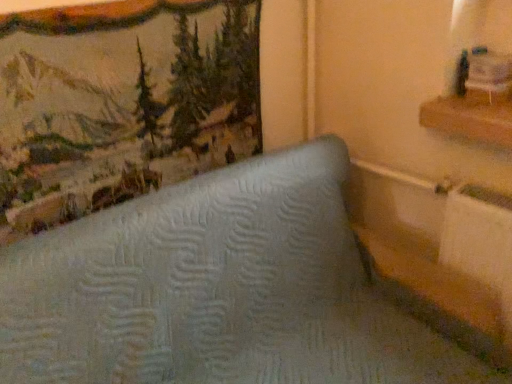
Question: Should I look upward or downward to see light blue quilted mattress at center?

Choices:
 (A) down
 (B) up

Answer: (A)

Question: Are wooden shelf at upper right and textured fabric picture frame at upper left beside each other?

Choices:
 (A) yes
 (B) no

Answer: (B)

Question: From a real-world perspective, is wooden shelf at upper right below textured fabric picture frame at upper left?

Choices:
 (A) yes
 (B) no

Answer: (A)

Question: Can textured fabric picture frame at upper left be found inside wooden shelf at upper right?

Choices:
 (A) yes
 (B) no

Answer: (B)

Question: Can you confirm if wooden shelf at upper right is positioned to the right of textured fabric picture frame at upper left?

Choices:
 (A) no
 (B) yes

Answer: (B)

Question: From the image's perspective, is wooden shelf at upper right under textured fabric picture frame at upper left?

Choices:
 (A) no
 (B) yes

Answer: (B)

Question: Considering the relative positions of wooden shelf at upper right and textured fabric picture frame at upper left in the image provided, is wooden shelf at upper right behind textured fabric picture frame at upper left?

Choices:
 (A) no
 (B) yes

Answer: (B)

Question: Is wooden shelf at upper right far away from light blue quilted mattress at center?

Choices:
 (A) no
 (B) yes

Answer: (A)

Question: Does wooden shelf at upper right have a greater height compared to light blue quilted mattress at center?

Choices:
 (A) no
 (B) yes

Answer: (A)

Question: Does wooden shelf at upper right turn towards light blue quilted mattress at center?

Choices:
 (A) yes
 (B) no

Answer: (B)

Question: Is wooden shelf at upper right to the right of light blue quilted mattress at center from the viewer's perspective?

Choices:
 (A) yes
 (B) no

Answer: (A)

Question: Does wooden shelf at upper right have a larger size compared to light blue quilted mattress at center?

Choices:
 (A) no
 (B) yes

Answer: (A)

Question: Is wooden shelf at upper right directly adjacent to light blue quilted mattress at center?

Choices:
 (A) yes
 (B) no

Answer: (B)

Question: Is light blue quilted mattress at center positioned before wooden shelf at upper right?

Choices:
 (A) no
 (B) yes

Answer: (B)